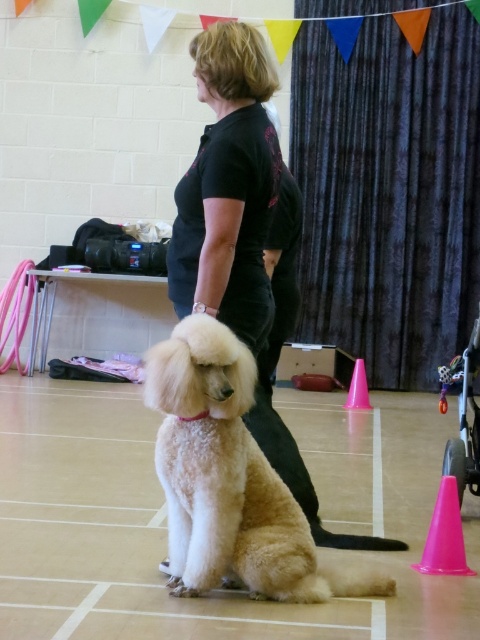
Which is more to the left, light beige fur at center or metallic silver baby carriage at lower right?

light beige fur at center

Between point (252, 516) and point (443, 385), which one is positioned in front?

Positioned in front is point (252, 516).

This screenshot has height=640, width=480. I want to click on light beige fur at center, so click(x=228, y=477).

Can you confirm if black smooth shirt at center is taller than pink plastic cone at center-right?

Yes, black smooth shirt at center is taller than pink plastic cone at center-right.

Who is higher up, black smooth shirt at center or pink plastic cone at center-right?

black smooth shirt at center

Identify the location of black smooth shirt at center. (228, 188).

Can you confirm if pink plastic cone at lower right is smaller than pink plastic cone at center-right?

Yes, pink plastic cone at lower right is smaller than pink plastic cone at center-right.

Describe the element at coordinates (444, 536) in the screenshot. I see `pink plastic cone at lower right` at that location.

Who is more distant from viewer, (454, 544) or (363, 384)?

Positioned behind is point (363, 384).

This screenshot has width=480, height=640. Find the location of `pink plastic cone at lower right`. pink plastic cone at lower right is located at coordinates (444, 536).